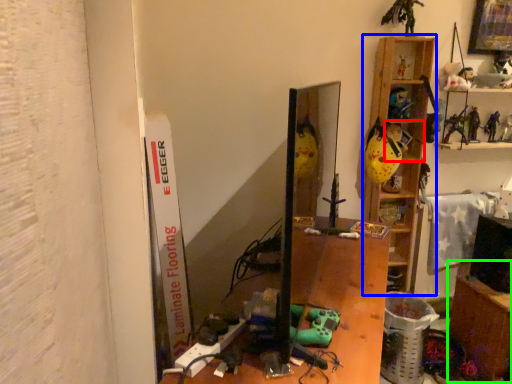
Question: Based on their relative distances, which object is farther from shelf (highlighted by a red box)? Choose from shelf (highlighted by a blue box) and table (highlighted by a green box).

Choices:
 (A) shelf
 (B) table

Answer: (B)